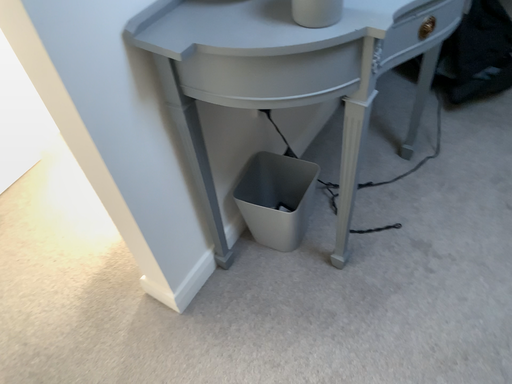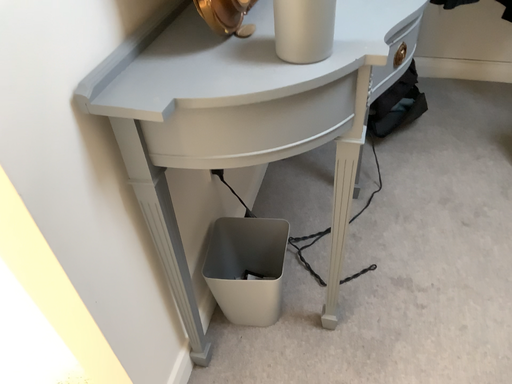
Question: Which way did the camera rotate in the video?

Choices:
 (A) rotated upward
 (B) rotated downward

Answer: (A)